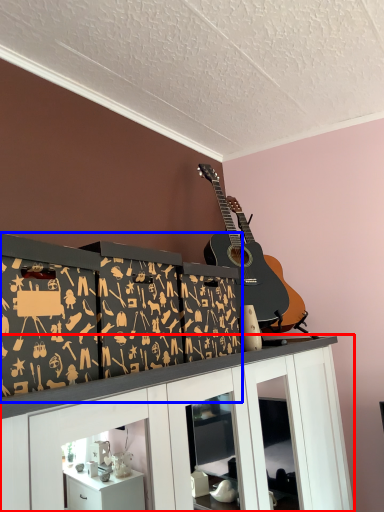
Question: Which of the following is the farthest to the observer, cabinetry (highlighted by a red box) or shelf (highlighted by a blue box)?

Choices:
 (A) cabinetry
 (B) shelf

Answer: (B)